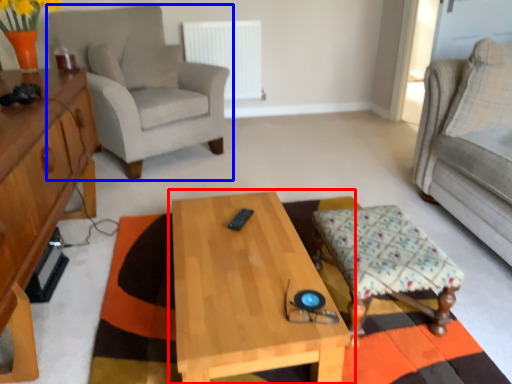
Question: Among these objects, which one is nearest to the camera, coffee table (highlighted by a red box) or chair (highlighted by a blue box)?

Choices:
 (A) coffee table
 (B) chair

Answer: (A)